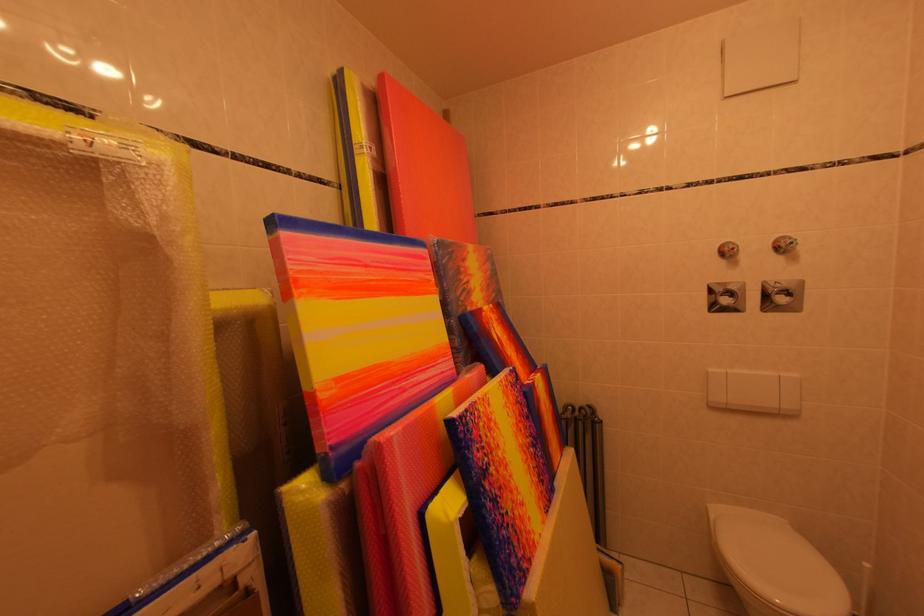
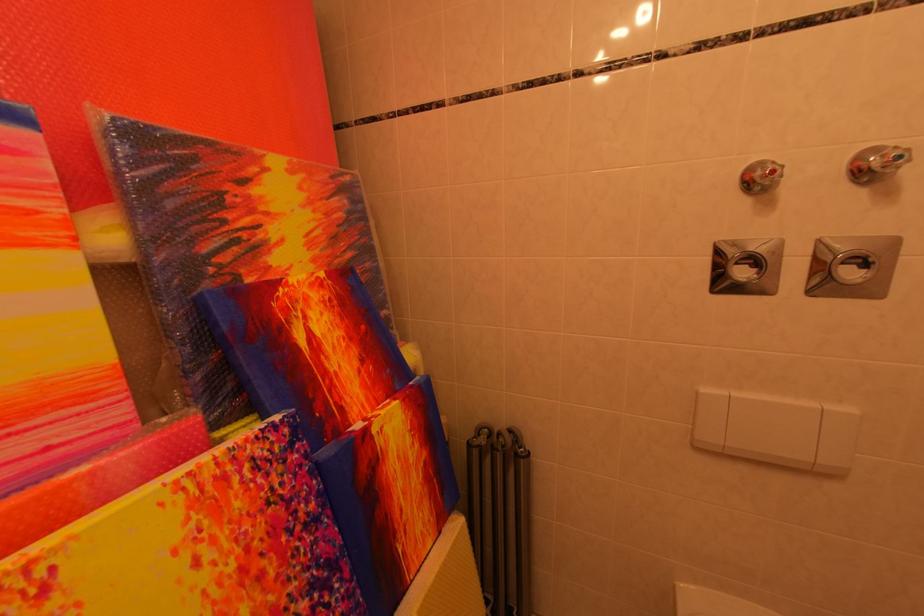
Where in the second image is the point corresponding to (x=734, y=305) from the first image?

(751, 277)